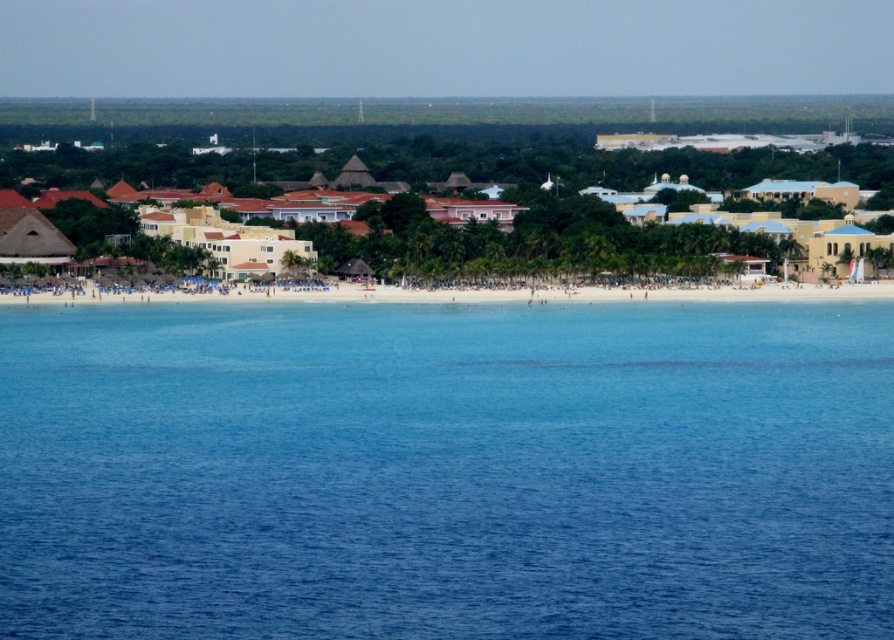
You are standing on the white sandy beach at center and want to reach the yellow matte building at center. Which direction should you walk to get closer to the building?

The yellow matte building at center is further to the viewer than the white sandy beach at center, so you should walk forward towards the building since it is closer to you than the beach.

You are a tourist standing on the white sandy beach at center and want to reach the yellow matte building at center. Which direction should you walk to get there?

The yellow matte building at center is located above the white sandy beach at center, so you should walk towards the direction where the building is situated, which is above the beach.

You are standing at the point with coordinates [447,470] in the coastal scene. What do you see directly in front of you?

You see clear blue water at center directly in front of you at point [447,470].